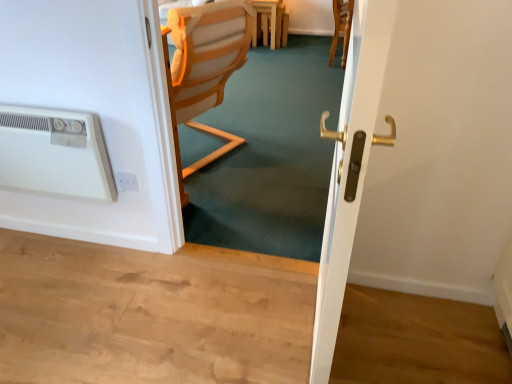
This screenshot has width=512, height=384. Find the location of `vacant space that is to the left of white glossy door handle at center`. vacant space that is to the left of white glossy door handle at center is located at coordinates click(221, 326).